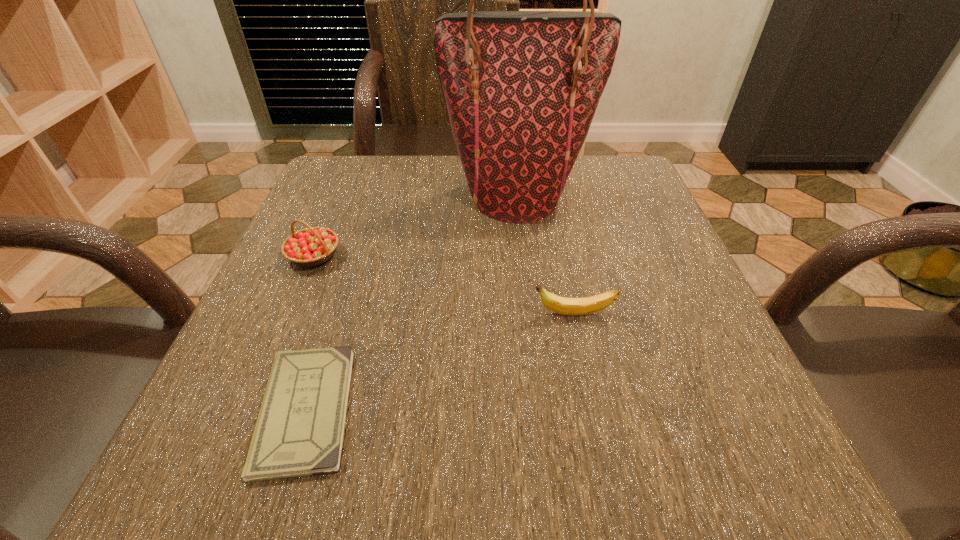
Where is `free space that satisfies the following two spatial constraints: 1. on the back side of the handbag; 2. on the left side of the strawberry`? This screenshot has width=960, height=540. free space that satisfies the following two spatial constraints: 1. on the back side of the handbag; 2. on the left side of the strawberry is located at coordinates (340, 196).